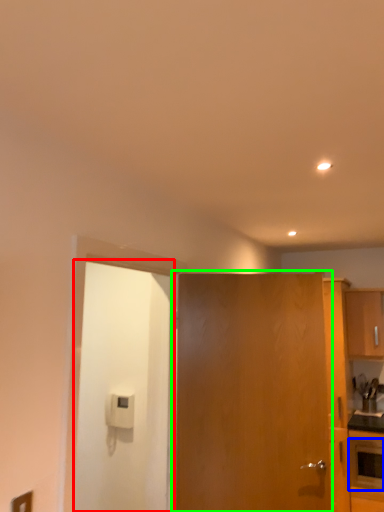
Question: Which object is the closest to the door (highlighted by a red box)? Choose among these: appliance (highlighted by a blue box) or door (highlighted by a green box).

Choices:
 (A) appliance
 (B) door

Answer: (B)